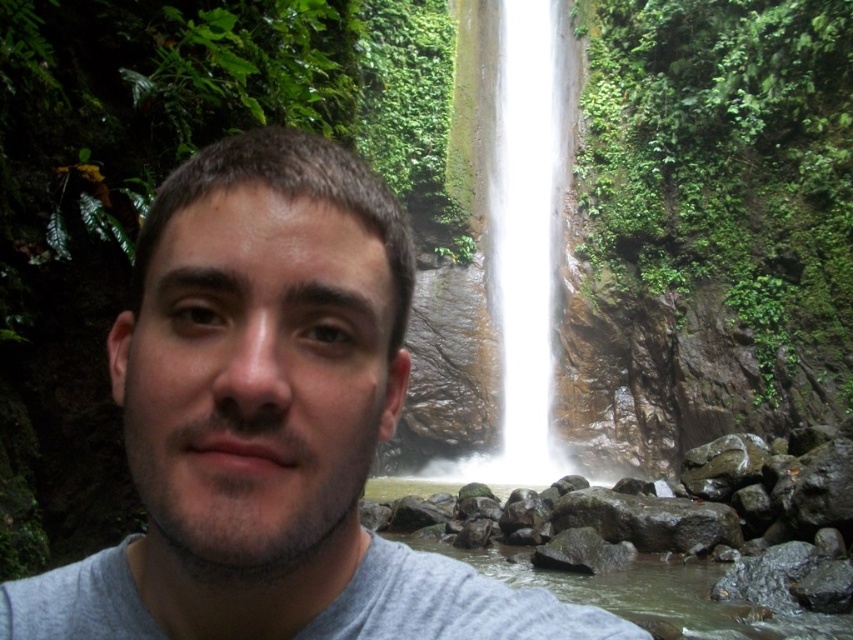
The width and height of the screenshot is (853, 640). I want to click on gray cotton shirt at center, so (270, 422).

Who is lower down, gray cotton shirt at center or white smooth waterfall at center?

A: Positioned lower is gray cotton shirt at center.

Does point (277, 632) lie in front of point (502, 403)?

Yes, point (277, 632) is closer to viewer.

The height and width of the screenshot is (640, 853). Find the location of `gray cotton shirt at center`. gray cotton shirt at center is located at coordinates (270, 422).